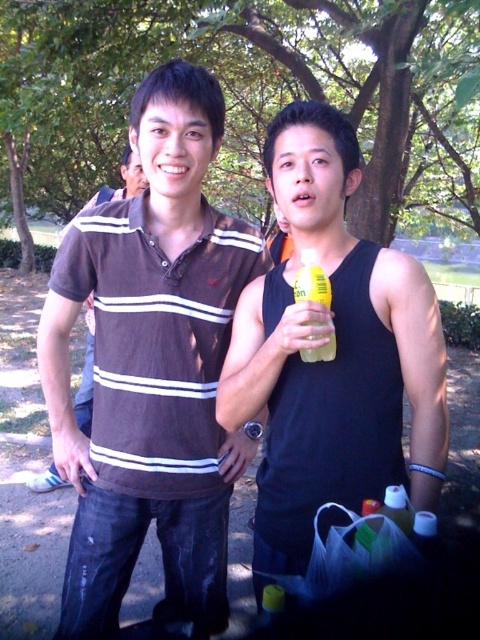
Is brown striped shirt at center positioned before yellow plastic bottle at center?

No, it is not.

Which is behind, point (90, 381) or point (316, 275)?

Point (90, 381)

You are a GUI agent. You are given a task and a screenshot of the screen. Output one action in this format:
    pyautogui.click(x=<x>, y=<y>)
    Task: Click on the brown striped shirt at center
    The height and width of the screenshot is (640, 480).
    Given the screenshot: What is the action you would take?
    pyautogui.click(x=85, y=376)

Which is above, black matte tank top at center or yellow plastic bottle at center?

Positioned higher is yellow plastic bottle at center.

Does black matte tank top at center lie behind yellow plastic bottle at center?

No, black matte tank top at center is in front of yellow plastic bottle at center.

What do you see at coordinates (336, 355) in the screenshot?
I see `black matte tank top at center` at bounding box center [336, 355].

Image resolution: width=480 pixels, height=640 pixels. In order to click on black matte tank top at center in this screenshot , I will do `click(336, 355)`.

Measure the distance from black matte tank top at center to brown striped shirt at center.

36.36 inches

Who is higher up, black matte tank top at center or brown striped shirt at center?

brown striped shirt at center is higher up.

Image resolution: width=480 pixels, height=640 pixels. What do you see at coordinates (336, 355) in the screenshot? I see `black matte tank top at center` at bounding box center [336, 355].

Where is `black matte tank top at center`? This screenshot has height=640, width=480. black matte tank top at center is located at coordinates (336, 355).